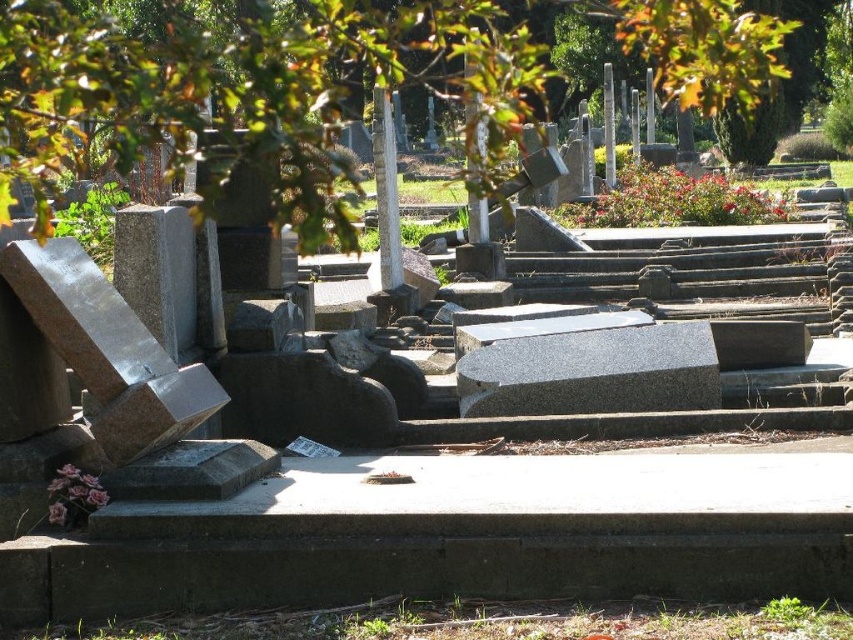
You are standing in a cemetery and want to take a photo of the green leafy tree at upper center. If your camera has a maximum focus range of 30 feet, will you be able to capture the tree clearly?

The green leafy tree at upper center is 31.72 feet away from viewer, which exceeds the camera maximum focus range of 30 feet. Therefore, you won need to move closer to ensure the tree is in focus.